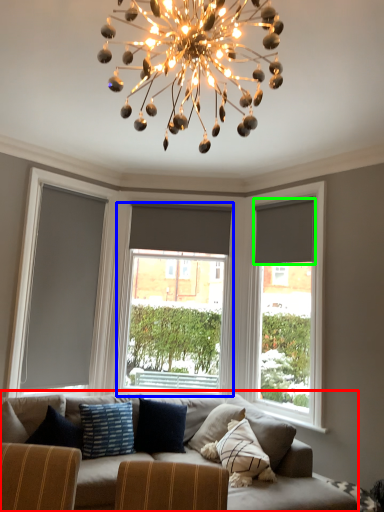
Question: Which object is positioned closest to studio couch (highlighted by a red box)? Select from window (highlighted by a blue box) and curtain (highlighted by a green box).

Choices:
 (A) window
 (B) curtain

Answer: (B)